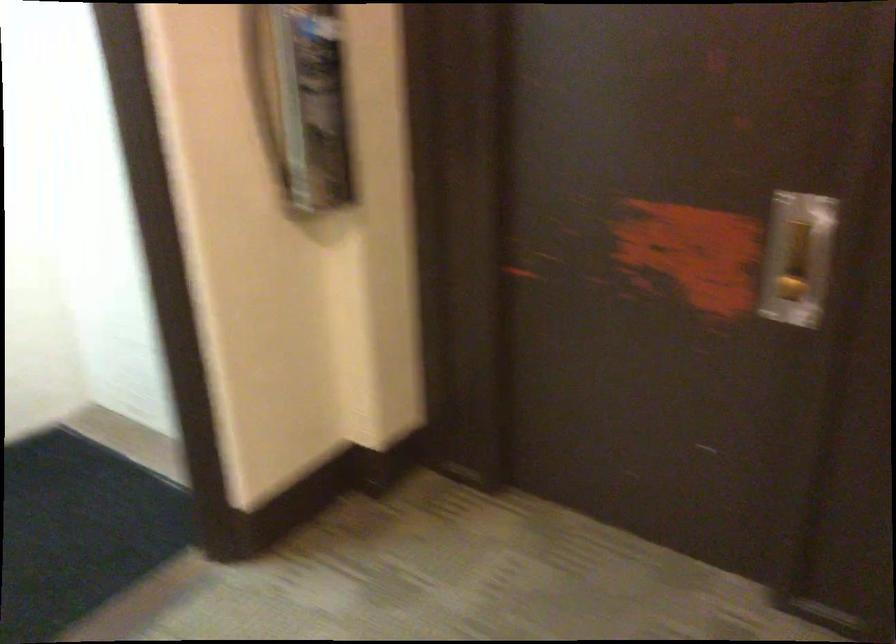
Find where to lift the wall phone handset. Please return your answer as a coordinate pair (x, y).

(303, 102)